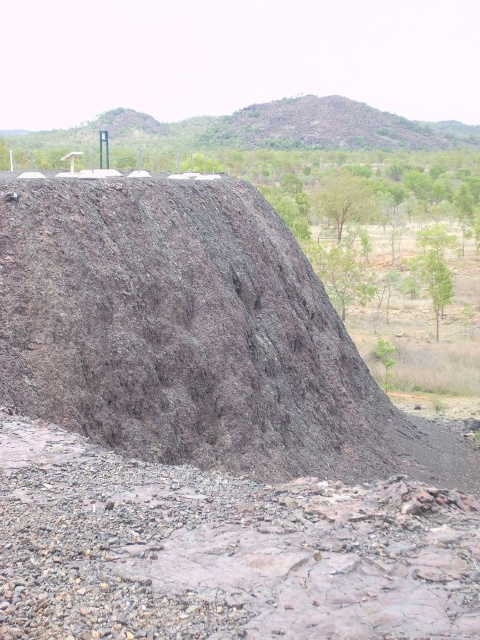
Looking at this image, does brown gravel at center come in front of brown rough rock at upper center?

Yes, it is.

Does brown gravel at center appear over brown rough rock at upper center?

Actually, brown gravel at center is below brown rough rock at upper center.

Who is more distant from viewer, (x=389, y=627) or (x=94, y=129)?

The point (x=94, y=129) is behind.

Image resolution: width=480 pixels, height=640 pixels. Find the location of `brown gravel at center`. brown gravel at center is located at coordinates (223, 550).